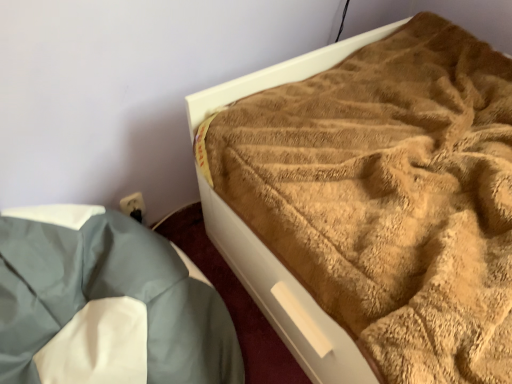
Question: Should I look upward or downward to see brown fuzzy blanket at upper right?

Choices:
 (A) up
 (B) down

Answer: (A)

Question: Are light blue fabric at lower left and brown fuzzy blanket at upper right making contact?

Choices:
 (A) yes
 (B) no

Answer: (B)

Question: Is light blue fabric at lower left aimed at brown fuzzy blanket at upper right?

Choices:
 (A) yes
 (B) no

Answer: (B)

Question: Is light blue fabric at lower left positioned before brown fuzzy blanket at upper right?

Choices:
 (A) yes
 (B) no

Answer: (A)

Question: Does light blue fabric at lower left contain brown fuzzy blanket at upper right?

Choices:
 (A) no
 (B) yes

Answer: (A)

Question: Is light blue fabric at lower left bigger than brown fuzzy blanket at upper right?

Choices:
 (A) no
 (B) yes

Answer: (A)

Question: Is light blue fabric at lower left not inside brown fuzzy blanket at upper right?

Choices:
 (A) yes
 (B) no

Answer: (A)

Question: Are brown fuzzy blanket at upper right and light blue fabric at lower left located far from each other?

Choices:
 (A) no
 (B) yes

Answer: (A)

Question: Is brown fuzzy blanket at upper right behind light blue fabric at lower left?

Choices:
 (A) no
 (B) yes

Answer: (B)

Question: Can you confirm if brown fuzzy blanket at upper right is taller than light blue fabric at lower left?

Choices:
 (A) yes
 (B) no

Answer: (B)

Question: Is brown fuzzy blanket at upper right closer to the viewer compared to light blue fabric at lower left?

Choices:
 (A) no
 (B) yes

Answer: (A)

Question: Is brown fuzzy blanket at upper right facing towards light blue fabric at lower left?

Choices:
 (A) no
 (B) yes

Answer: (A)

Question: Is light blue fabric at lower left at the back of brown fuzzy blanket at upper right?

Choices:
 (A) no
 (B) yes

Answer: (A)

Question: Is brown fuzzy blanket at upper right bigger or smaller than light blue fabric at lower left?

Choices:
 (A) big
 (B) small

Answer: (A)